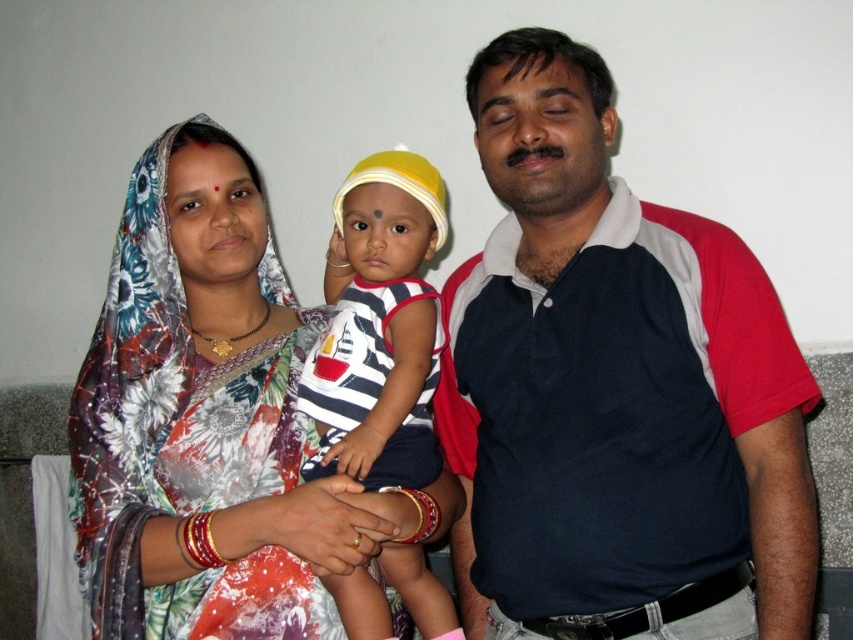
Does dark blue polo shirt at right have a lesser width compared to striped fabric shirt at center?

No.

Describe the element at coordinates (614, 388) in the screenshot. This screenshot has width=853, height=640. I see `dark blue polo shirt at right` at that location.

Between point (471, 285) and point (405, 576), which one is positioned behind?

Point (471, 285)

Image resolution: width=853 pixels, height=640 pixels. What are the coordinates of `dark blue polo shirt at right` in the screenshot? It's located at (614, 388).

Does floral fabric saree at center appear under striped fabric shirt at center?

No.

What do you see at coordinates (212, 422) in the screenshot? Image resolution: width=853 pixels, height=640 pixels. I see `floral fabric saree at center` at bounding box center [212, 422].

The height and width of the screenshot is (640, 853). I want to click on floral fabric saree at center, so click(212, 422).

From the picture: Measure the distance between dark blue polo shirt at right and floral fabric saree at center.

A distance of 14.21 inches exists between dark blue polo shirt at right and floral fabric saree at center.

Does dark blue polo shirt at right have a lesser height compared to floral fabric saree at center?

No.

What do you see at coordinates (614, 388) in the screenshot? Image resolution: width=853 pixels, height=640 pixels. I see `dark blue polo shirt at right` at bounding box center [614, 388].

The height and width of the screenshot is (640, 853). Identify the location of dark blue polo shirt at right. (614, 388).